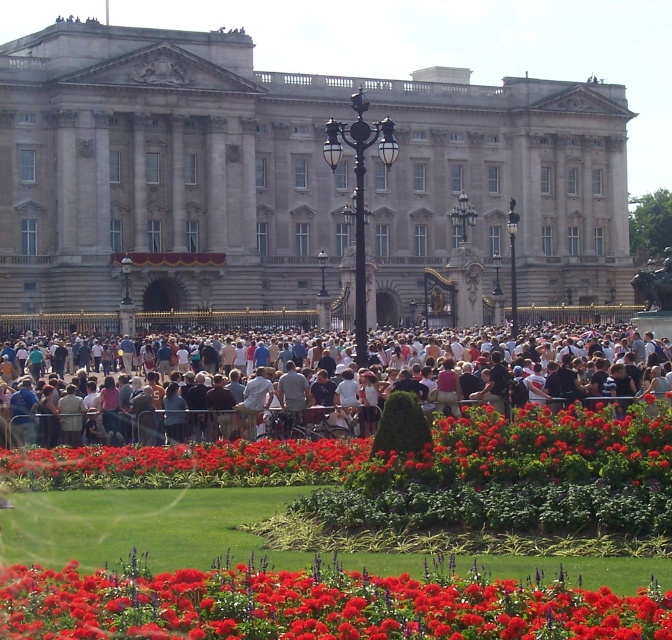
You are a photographer standing in front of Buckingham Palace. You want to capture a photo that includes both the light brown wooden bench at center and the vivid red petals at center. Which object should you focus on first to ensure both are in the frame?

The light brown wooden bench at center has a larger size compared to the vivid red petals at center, so you should focus on the bench first to ensure both are in the frame.

You are a photographer standing in front of the Buckingham Palace scene described. You want to capture a photo that includes the stone facade palace at center while ensuring the entire structure is visible. Given the palace is located at coordinates point 0.280, 0.429, would positioning your camera directly facing this point allow you to frame the palace properly?

The stone facade palace at center is located at point (288, 179). Positioning the camera directly facing this point should allow the entire structure to be framed properly as it is centered in the scene.